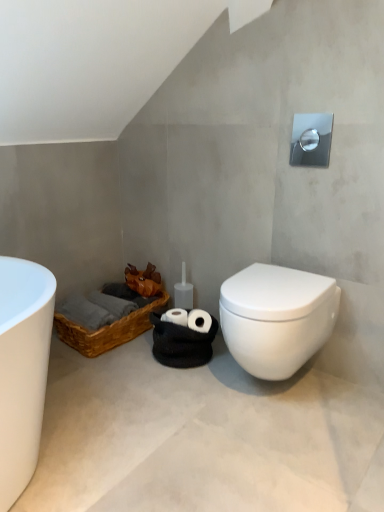
Question: From the image's perspective, is white glossy toilet at lower right on white matte concrete at lower center?

Choices:
 (A) yes
 (B) no

Answer: (A)

Question: Is white glossy toilet at lower right not within white matte concrete at lower center?

Choices:
 (A) no
 (B) yes

Answer: (B)

Question: Can you confirm if white glossy toilet at lower right is smaller than white matte concrete at lower center?

Choices:
 (A) yes
 (B) no

Answer: (A)

Question: Is white glossy toilet at lower right oriented towards white matte concrete at lower center?

Choices:
 (A) yes
 (B) no

Answer: (B)

Question: Is the surface of white glossy toilet at lower right in direct contact with white matte concrete at lower center?

Choices:
 (A) yes
 (B) no

Answer: (B)

Question: Is white glossy toilet at lower right to the right of white matte concrete at lower center from the viewer's perspective?

Choices:
 (A) no
 (B) yes

Answer: (B)

Question: Is brown woven basket at lower left shorter than white glossy toilet at lower right?

Choices:
 (A) no
 (B) yes

Answer: (B)

Question: Is brown woven basket at lower left taller than white glossy toilet at lower right?

Choices:
 (A) no
 (B) yes

Answer: (A)

Question: Is brown woven basket at lower left closer to the viewer compared to white glossy toilet at lower right?

Choices:
 (A) yes
 (B) no

Answer: (B)

Question: Considering the relative positions of brown woven basket at lower left and white glossy toilet at lower right in the image provided, is brown woven basket at lower left to the left of white glossy toilet at lower right from the viewer's perspective?

Choices:
 (A) no
 (B) yes

Answer: (B)

Question: Can you confirm if brown woven basket at lower left is smaller than white glossy toilet at lower right?

Choices:
 (A) no
 (B) yes

Answer: (B)

Question: Is brown woven basket at lower left in contact with white glossy toilet at lower right?

Choices:
 (A) no
 (B) yes

Answer: (A)

Question: Is white matte concrete at lower center smaller than white glossy toilet at lower right?

Choices:
 (A) yes
 (B) no

Answer: (B)